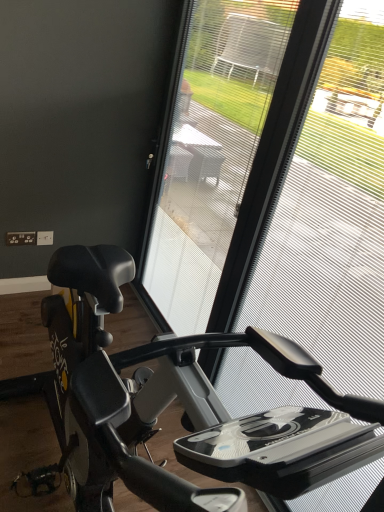
Question: Is black matte stationary bicycle at center bigger than transparent mesh at center?

Choices:
 (A) no
 (B) yes

Answer: (B)

Question: Is black matte stationary bicycle at center completely or partially outside of transparent mesh at center?

Choices:
 (A) no
 (B) yes

Answer: (B)

Question: From the image's perspective, is black matte stationary bicycle at center located above transparent mesh at center?

Choices:
 (A) no
 (B) yes

Answer: (A)

Question: Considering the relative positions of black matte stationary bicycle at center and transparent mesh at center in the image provided, is black matte stationary bicycle at center behind transparent mesh at center?

Choices:
 (A) yes
 (B) no

Answer: (B)

Question: Does black matte stationary bicycle at center lie in front of transparent mesh at center?

Choices:
 (A) yes
 (B) no

Answer: (A)

Question: Is black matte stationary bicycle at center taller than transparent mesh at center?

Choices:
 (A) yes
 (B) no

Answer: (B)

Question: Is transparent mesh at center directly adjacent to black matte stationary bicycle at center?

Choices:
 (A) yes
 (B) no

Answer: (B)

Question: Could you tell me if transparent mesh at center is turned towards black matte stationary bicycle at center?

Choices:
 (A) no
 (B) yes

Answer: (B)

Question: Is transparent mesh at center smaller than black matte stationary bicycle at center?

Choices:
 (A) yes
 (B) no

Answer: (A)

Question: Can you confirm if transparent mesh at center is bigger than black matte stationary bicycle at center?

Choices:
 (A) no
 (B) yes

Answer: (A)

Question: Is transparent mesh at center at the left side of black matte stationary bicycle at center?

Choices:
 (A) no
 (B) yes

Answer: (A)

Question: Are transparent mesh at center and black matte stationary bicycle at center far apart?

Choices:
 (A) no
 (B) yes

Answer: (B)

Question: From a real-world perspective, is black matte stationary bicycle at center under transparent plastic screen door at center?

Choices:
 (A) yes
 (B) no

Answer: (A)